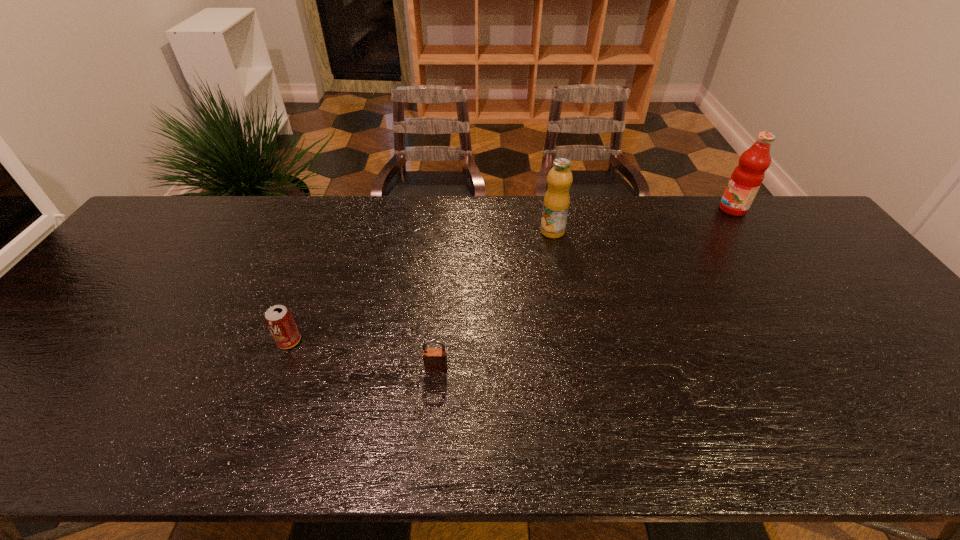
This screenshot has width=960, height=540. Find the location of `free space located on the front label of the farthest object`. free space located on the front label of the farthest object is located at coordinates (619, 209).

You are a GUI agent. You are given a task and a screenshot of the screen. Output one action in this format:
    pyautogui.click(x=<x>, y=<y>)
    Task: Click on the vacant space located 0.150m on the front label of the third object from left to right
    
    Given the screenshot: What is the action you would take?
    pyautogui.click(x=560, y=272)

This screenshot has height=540, width=960. In order to click on vacant space located 0.240m on the right of the second nearest object in this screenshot , I will do `click(397, 341)`.

You are a GUI agent. You are given a task and a screenshot of the screen. Output one action in this format:
    pyautogui.click(x=<x>, y=<y>)
    Task: Click on the vacant position located on the front-facing side of the padlock
    The width and height of the screenshot is (960, 540).
    Given the screenshot: What is the action you would take?
    pyautogui.click(x=432, y=423)

I want to click on vacant region at the far edge of the desktop, so click(455, 196).

Where is `vacant area at the near edge`? The image size is (960, 540). vacant area at the near edge is located at coordinates (165, 422).

I want to click on vacant space at the left edge, so click(39, 403).

Where is `free space at the right edge`? The height and width of the screenshot is (540, 960). free space at the right edge is located at coordinates (845, 267).

Find the location of a particular element. The height and width of the screenshot is (540, 960). vacant space at the far left corner of the desktop is located at coordinates (189, 224).

Where is `vacant space at the far right corner of the desktop`? vacant space at the far right corner of the desktop is located at coordinates (778, 216).